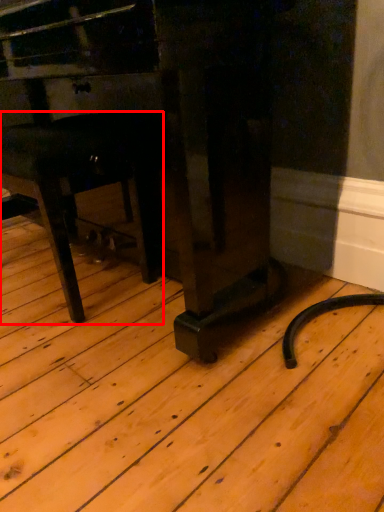
Question: From the image's perspective, where is furniture (annotated by the red box) located relative to furniture?

Choices:
 (A) below
 (B) above

Answer: (A)